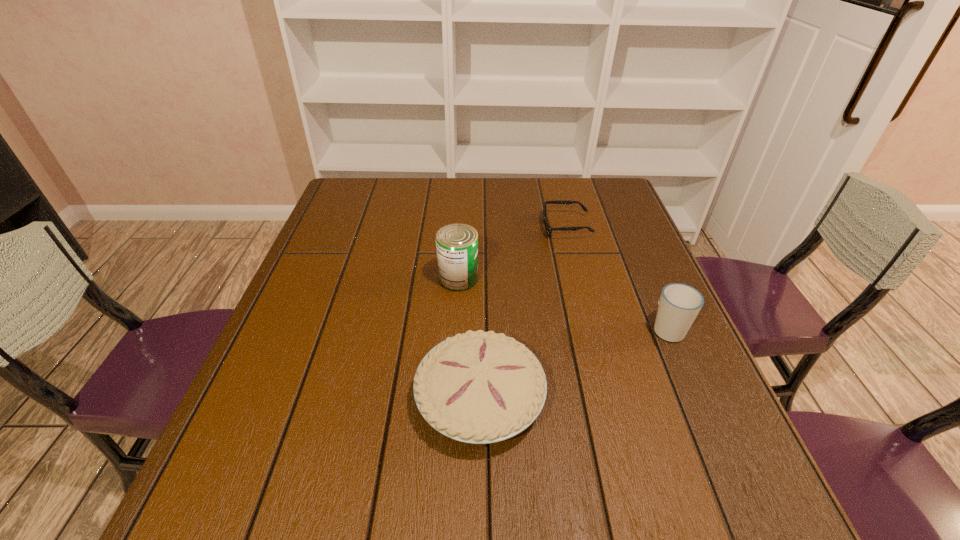
You are a GUI agent. You are given a task and a screenshot of the screen. Output one action in this format:
    pyautogui.click(x=<x>, y=<y>)
    Task: Click on the vacant space that's between the rightmost object and the sunglasses
    Image resolution: width=960 pixels, height=540 pixels.
    Given the screenshot: What is the action you would take?
    pyautogui.click(x=617, y=278)

Image resolution: width=960 pixels, height=540 pixels. What are the coordinates of `free spot between the tallest object and the farthest object` in the screenshot? It's located at (512, 253).

The image size is (960, 540). Identify the location of vacant area that lies between the shortest object and the tallest object. (512, 253).

The image size is (960, 540). Find the location of `vacant region between the sunglasses and the can`. vacant region between the sunglasses and the can is located at coordinates (512, 253).

In order to click on unoccupied position between the third shortest object and the can in this screenshot , I will do `click(564, 303)`.

Locate an element on the screen. The image size is (960, 540). vacant point located between the can and the shortest object is located at coordinates (512, 253).

Select which object appears as the closest to the cup. Please provide its 2D coordinates. Your answer should be formatted as a tuple, i.e. [(x, y)], where the tuple contains the x and y coordinates of a point satisfying the conditions above.

[(479, 387)]

Where is `object that ranks as the third closest to the nearest object`? Image resolution: width=960 pixels, height=540 pixels. object that ranks as the third closest to the nearest object is located at coordinates (549, 229).

The height and width of the screenshot is (540, 960). Find the location of `free space that satisfies the following two spatial constraints: 1. on the front-facing side of the second object from right to left; 2. with a handle on the side of the rightmost object`. free space that satisfies the following two spatial constraints: 1. on the front-facing side of the second object from right to left; 2. with a handle on the side of the rightmost object is located at coordinates (592, 329).

Locate an element on the screen. The image size is (960, 540). free space that satisfies the following two spatial constraints: 1. with a handle on the side of the third shortest object; 2. on the front-facing side of the sunglasses is located at coordinates (624, 227).